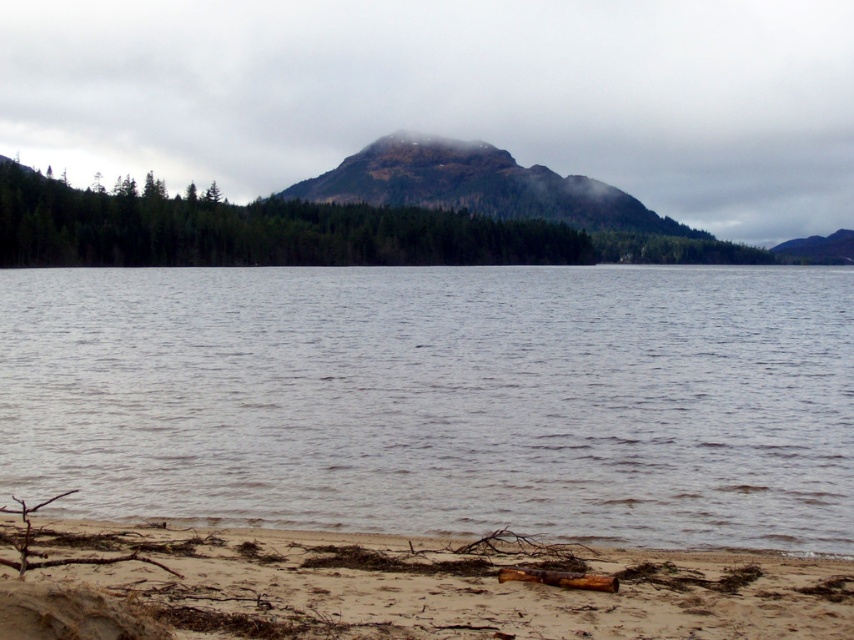
Question: Can you confirm if foggy mountain at upper center is positioned to the right of brown sandy beach at lower left?

Choices:
 (A) yes
 (B) no

Answer: (A)

Question: Estimate the real-world distances between objects in this image. Which object is farther from the brown sandy beach at lower left?

Choices:
 (A) rugged brown mountain at center
 (B) green matte forest at center
 (C) gray water at center

Answer: (A)

Question: Does gray water at center appear over foggy mountain at upper center?

Choices:
 (A) no
 (B) yes

Answer: (A)

Question: Among these objects, which one is nearest to the camera?

Choices:
 (A) green matte forest at center
 (B) rugged brown mountain at center
 (C) brown sandy beach at lower left

Answer: (C)

Question: Among these objects, which one is nearest to the camera?

Choices:
 (A) rugged brown mountain at center
 (B) foggy mountain at upper center
 (C) brown sandy beach at lower left

Answer: (C)

Question: Is gray water at center in front of green matte forest at center?

Choices:
 (A) yes
 (B) no

Answer: (A)